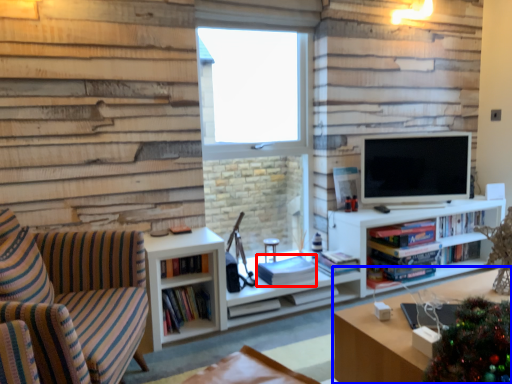
Question: Which object is further to the camera taking this photo, book (highlighted by a red box) or table (highlighted by a blue box)?

Choices:
 (A) book
 (B) table

Answer: (A)